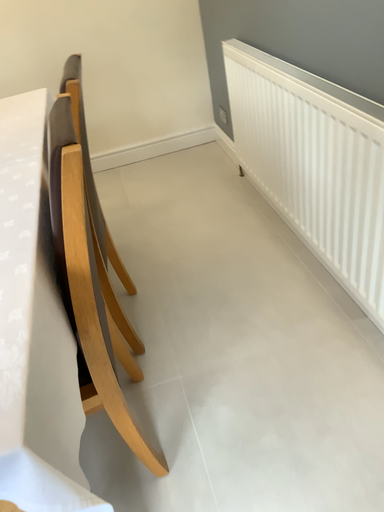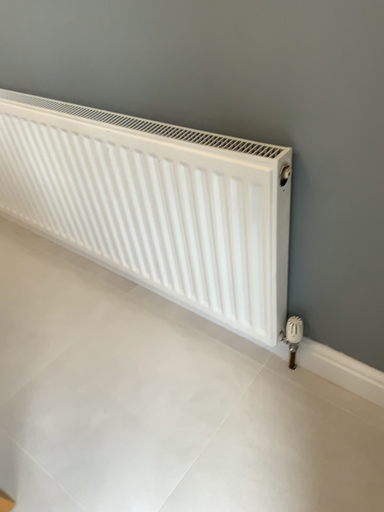
Question: How did the camera likely rotate when shooting the video?

Choices:
 (A) rotated downward
 (B) rotated upward

Answer: (B)